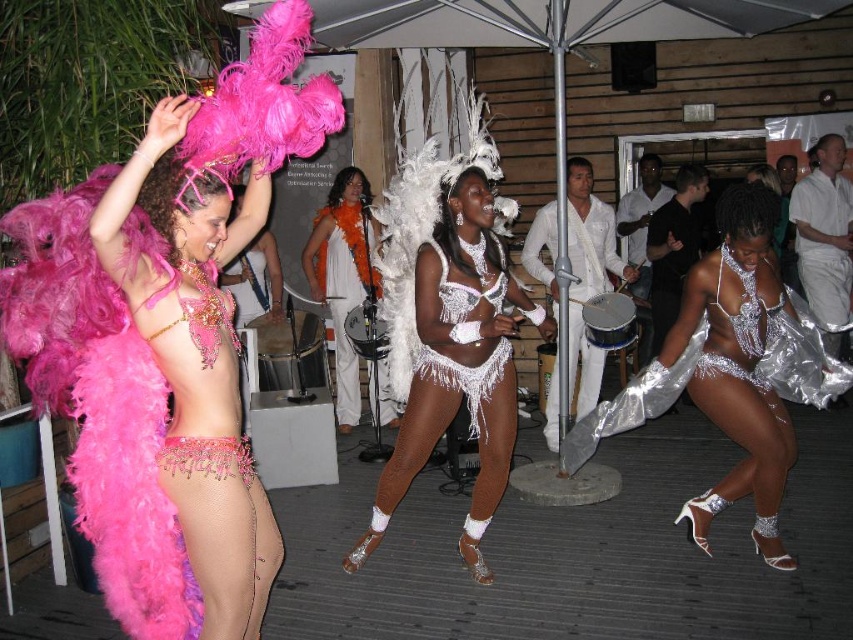
Question: Which object is the farthest from the orange feather boa at center?

Choices:
 (A) white metallic drum at center
 (B) pink feather boa at left

Answer: (B)

Question: From the image, what is the correct spatial relationship of matte pink feather boa at left in relation to white metallic drum at center?

Choices:
 (A) left
 (B) right

Answer: (A)

Question: Which object is farther from the camera taking this photo?

Choices:
 (A) white fringed bikini at center
 (B) pink feather boa at left
 (C) silver metallic bikini at lower right
 (D) white fabric umbrella at upper center

Answer: (D)

Question: Observing the image, what is the correct spatial positioning of silver metallic bikini at lower right in reference to silver metallic dress at right?

Choices:
 (A) left
 (B) right

Answer: (A)

Question: Which point appears farthest from the camera in this image?

Choices:
 (A) (480, 556)
 (B) (572, 256)
 (C) (322, 225)
 (D) (210, 179)

Answer: (C)

Question: Does pink feather boa at left appear on the right side of white sequined bikini at center?

Choices:
 (A) yes
 (B) no

Answer: (B)